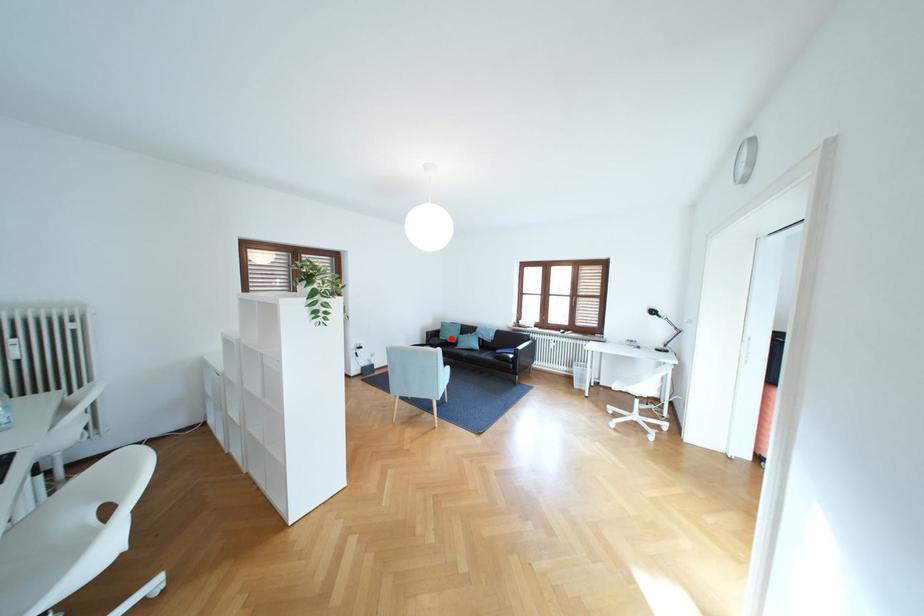
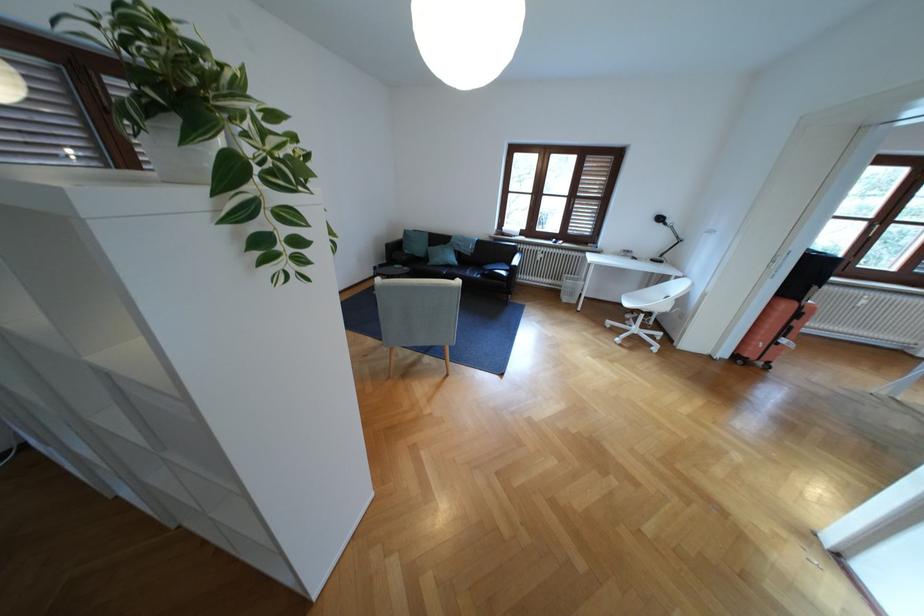
Find the pixel in the second image that matches the highlighted location in the first image.

(417, 252)